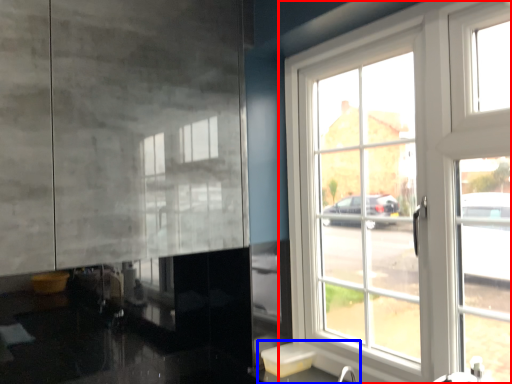
Question: Which point is further to the camera, window (highlighted by a red box) or sink (highlighted by a blue box)?

Choices:
 (A) window
 (B) sink

Answer: (A)